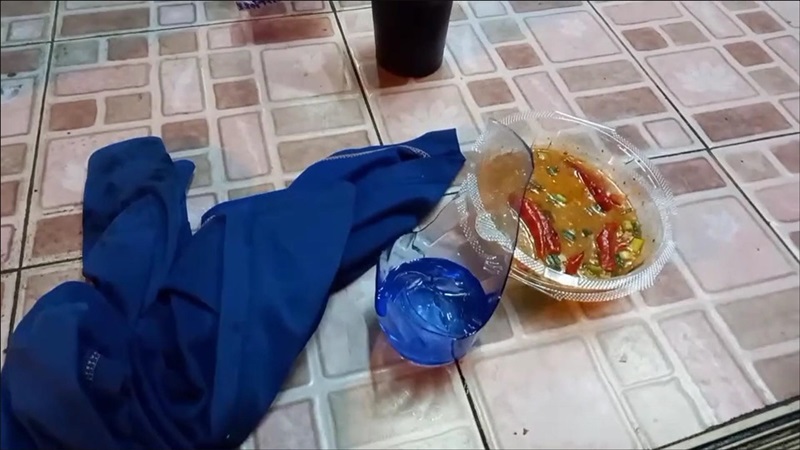
This screenshot has width=800, height=450. What are the coordinates of `plastic container` in the screenshot? It's located at (573, 285).